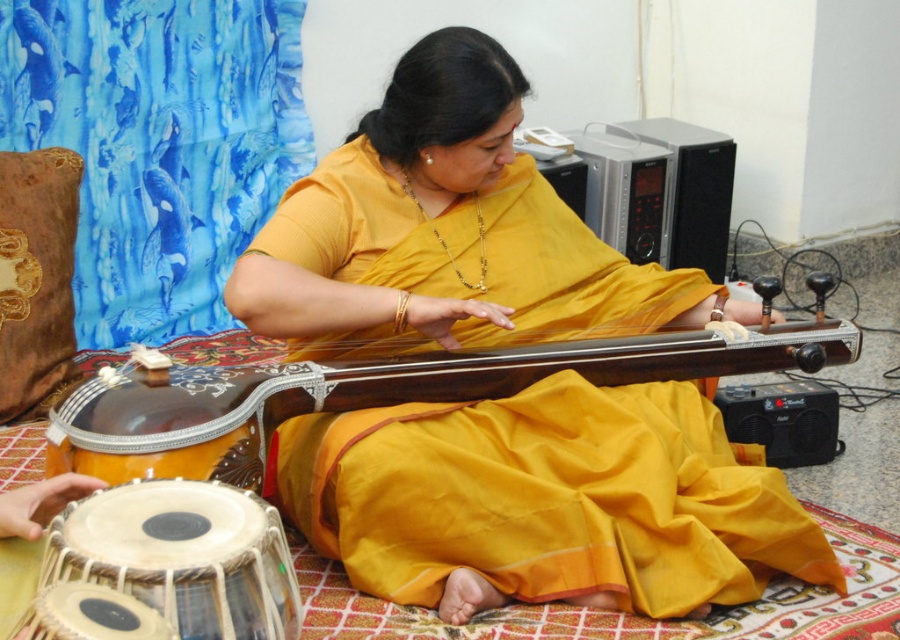
Question: Can you confirm if matte yellow sari at center is wider than white leather drum at lower left?

Choices:
 (A) no
 (B) yes

Answer: (B)

Question: Which point is farther to the camera?

Choices:
 (A) (381, 195)
 (B) (155, 506)
 (C) (477, 364)
 (D) (81, 596)

Answer: (A)

Question: Which point appears farthest from the camera in this image?

Choices:
 (A) (642, 337)
 (B) (162, 624)
 (C) (345, 227)

Answer: (A)

Question: Can you confirm if matte yellow sari at center is positioned to the left of matte silver drum at lower left?

Choices:
 (A) yes
 (B) no

Answer: (B)

Question: Which point appears closest to the camera in this image?

Choices:
 (A) (673, 339)
 (B) (112, 620)

Answer: (B)

Question: Is wooden/silver inlay sitar at center to the left of matte silver drum at lower left from the viewer's perspective?

Choices:
 (A) yes
 (B) no

Answer: (B)